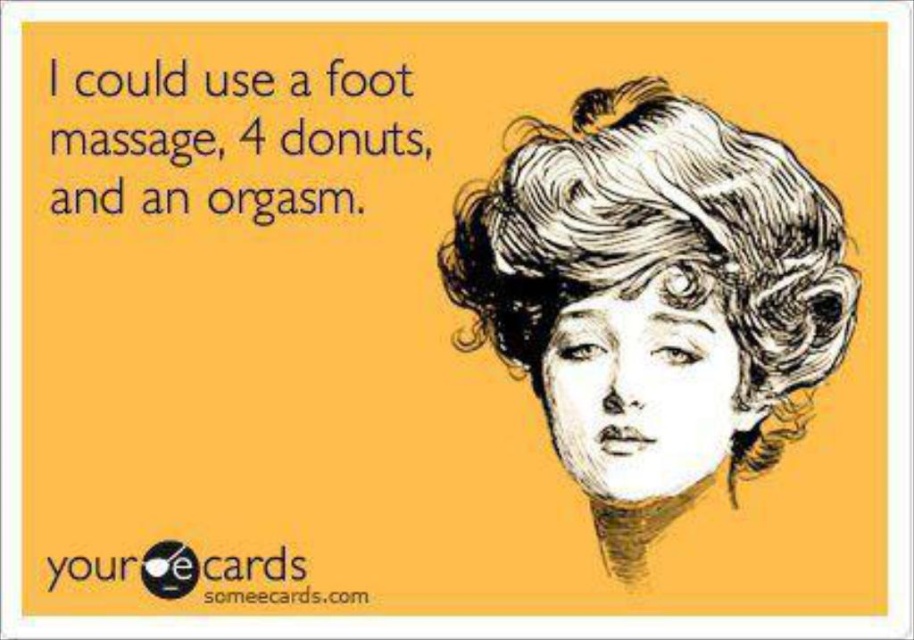
You are an art student analyzing this image. You need to determine which element is nearer to you between the white textured hair at upper right and the black text at upper left. Based on the spatial arrangement, which one is closer?

The white textured hair at upper right is closer to the viewer than the black text at upper left.

You are designing a poster and want to ensure the white textured hair at upper right and the black logo at upper center are visible from a distance. Based on their sizes, which one is more likely to be easily noticed first?

The white textured hair at upper right is larger in size compared to the black logo at upper center, so it will be more noticeable first.

Based on the photo, you are designing a poster and need to place the black text at upper left and the black logo at upper center. According to the image, which one is positioned in front of the other?

The black logo at upper center is behind the black text at upper left, so the black text at upper left is in front of the black logo at upper center.